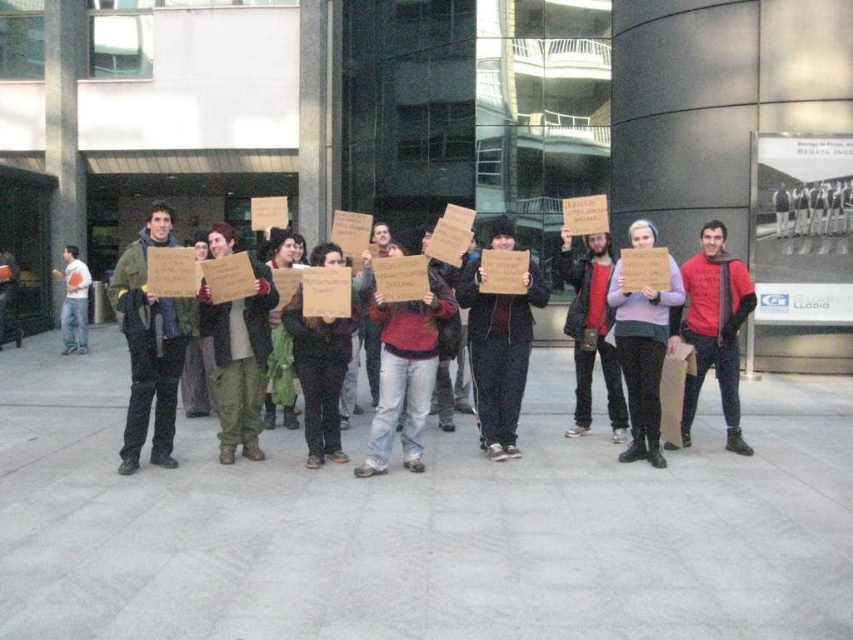
Question: Does matte red sweater at center have a greater width compared to white cotton shirt at left?

Choices:
 (A) no
 (B) yes

Answer: (B)

Question: Among these objects, which one is farthest from the camera?

Choices:
 (A) dark brown leather jacket at center
 (B) matte cardboard sign at center
 (C) camouflage pants at center

Answer: (C)

Question: Which point is farther to the camera?

Choices:
 (A) (258, 333)
 (B) (601, 260)
 (C) (376, 470)
 (D) (0, 280)

Answer: (D)

Question: Among these objects, which one is nearest to the camera?

Choices:
 (A) light purple sweater at center
 (B) camouflage pants at center
 (C) orange fabric bag at left
 (D) white cotton shirt at left

Answer: (B)

Question: Does matte red sweater at center appear under dark brown leather jacket at center?

Choices:
 (A) yes
 (B) no

Answer: (A)

Question: Does matte red sweater at center have a larger size compared to white cotton shirt at left?

Choices:
 (A) yes
 (B) no

Answer: (B)